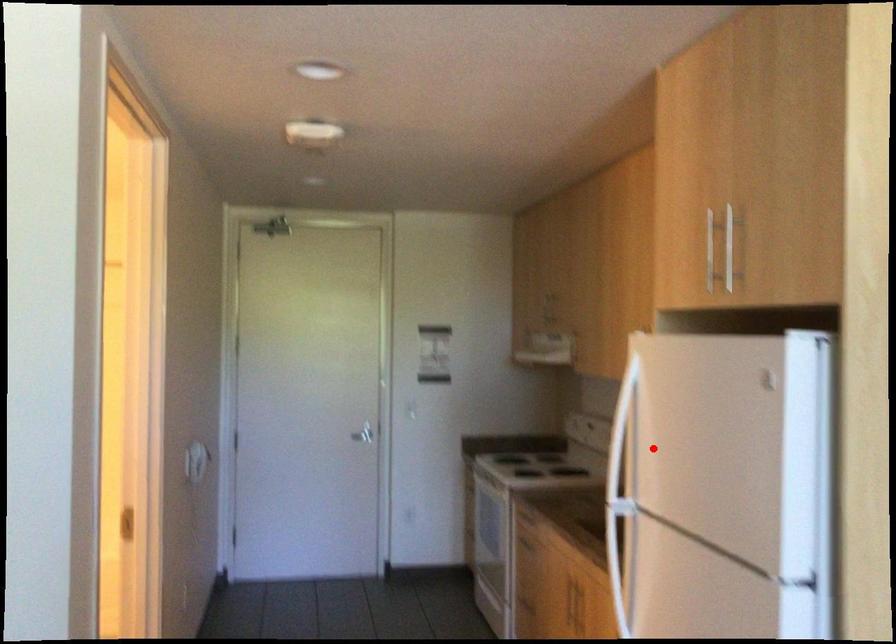
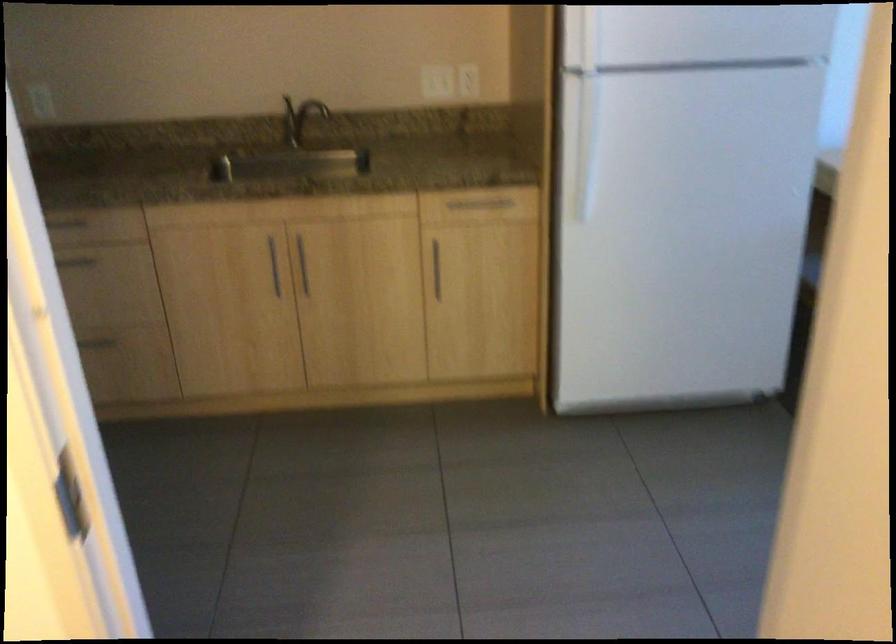
In the second image, find the point that corresponds to the highlighted location in the first image.

(581, 39)